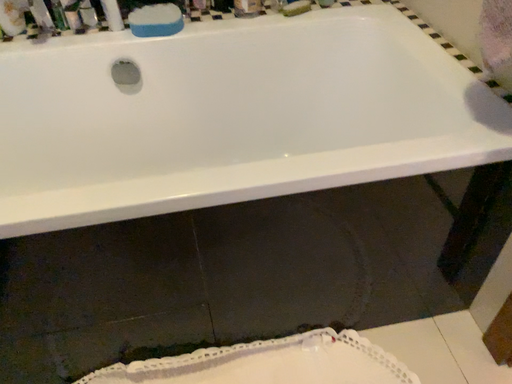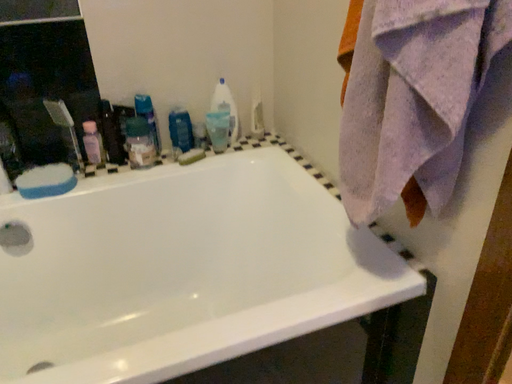
Question: Which way did the camera rotate in the video?

Choices:
 (A) rotated downward
 (B) rotated upward

Answer: (B)